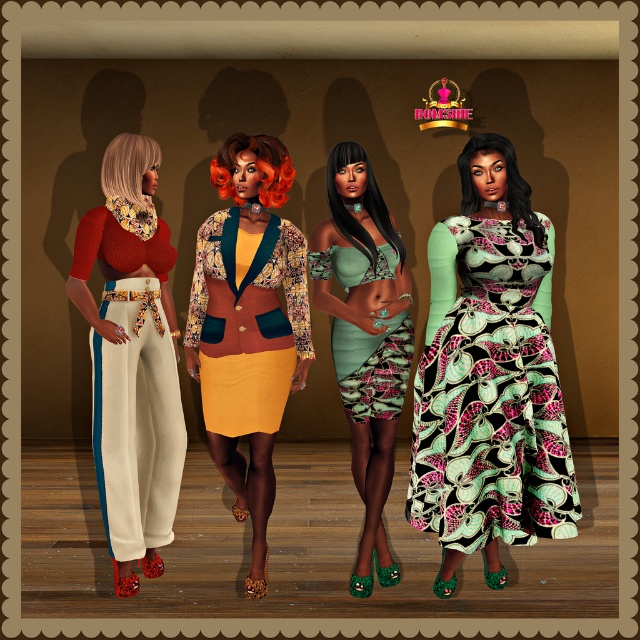
Can you confirm if matte floral pants at left is taller than textured velvet blazer at center?

Yes, matte floral pants at left is taller than textured velvet blazer at center.

Where is `matte floral pants at left`? The image size is (640, 640). matte floral pants at left is located at coordinates (131, 358).

What do you see at coordinates (131, 358) in the screenshot?
I see `matte floral pants at left` at bounding box center [131, 358].

In order to click on matte floral pants at left in this screenshot , I will do `click(131, 358)`.

Can you confirm if mint green satin dress at center is taller than metallic gold crown at upper center?

Indeed, mint green satin dress at center has a greater height compared to metallic gold crown at upper center.

You are a GUI agent. You are given a task and a screenshot of the screen. Output one action in this format:
    pyautogui.click(x=<x>, y=<y>)
    Task: Click on the mint green satin dress at center
    The height and width of the screenshot is (640, 640).
    Given the screenshot: What is the action you would take?
    pyautogui.click(x=372, y=365)

Locate an element on the screen. mint green satin dress at center is located at coordinates (372, 365).

Locate an element on the screen. The width and height of the screenshot is (640, 640). mint green satin dress at center is located at coordinates (372, 365).

Is point (556, 376) positioned after point (156, 500)?

No, it is not.

You are a GUI agent. You are given a task and a screenshot of the screen. Output one action in this format:
    pyautogui.click(x=<x>, y=<y>)
    Task: Click on the printed fabric dress at right
    
    Given the screenshot: What is the action you would take?
    pyautogui.click(x=492, y=401)